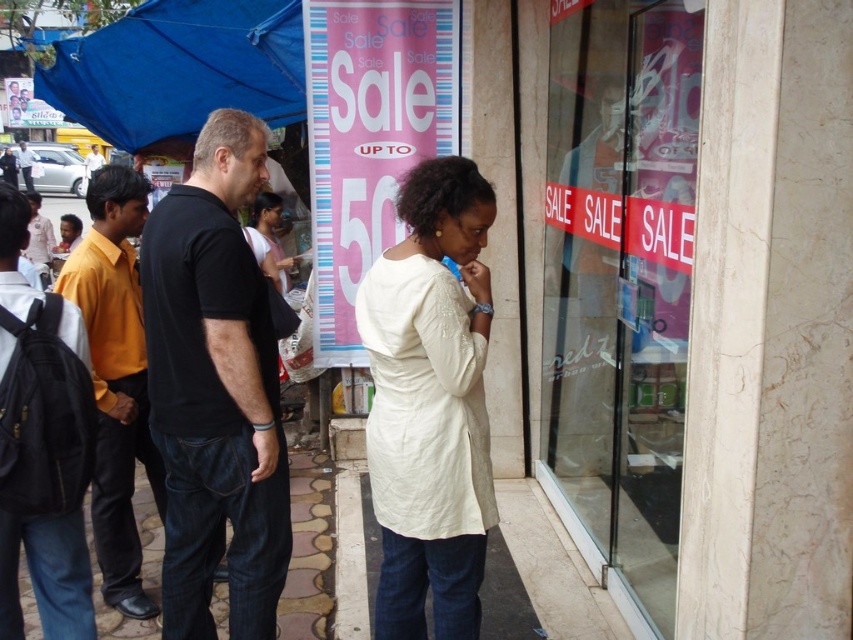
Based on the photo, can you confirm if white quilted dress at center is smaller than matte black shirt at left?

Correct, white quilted dress at center occupies less space than matte black shirt at left.

Does white quilted dress at center appear under matte black shirt at left?

Yes.

This screenshot has height=640, width=853. What are the coordinates of `white quilted dress at center` in the screenshot? It's located at (430, 403).

At what (x,y) coordinates should I click in order to perform the action: click on white quilted dress at center. Please return your answer as a coordinate pair (x, y). The image size is (853, 640). Looking at the image, I should click on (430, 403).

In the scene shown: Can you confirm if transparent glass at center is thinner than white shirt at left?

In fact, transparent glass at center might be wider than white shirt at left.

Where is `transparent glass at center`? This screenshot has height=640, width=853. transparent glass at center is located at coordinates (619, 276).

Between point (161, 264) and point (260, 211), which one is positioned in front?

Point (161, 264)

Does black cotton t-shirt at center have a lesser height compared to pink fabric shirt at center?

No.

Is point (172, 364) positioned behind point (248, 227)?

That is False.

The width and height of the screenshot is (853, 640). I want to click on black cotton t-shirt at center, so click(215, 388).